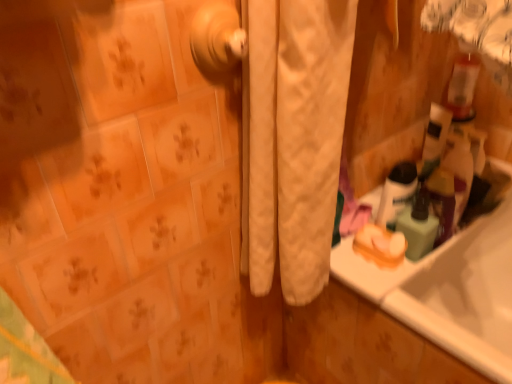
Question: Does white glossy mouthwash at upper right have a lesser height compared to white quilted curtain at center?

Choices:
 (A) yes
 (B) no

Answer: (A)

Question: Is white glossy mouthwash at upper right not within white quilted curtain at center?

Choices:
 (A) yes
 (B) no

Answer: (A)

Question: From a real-world perspective, is white glossy mouthwash at upper right beneath white quilted curtain at center?

Choices:
 (A) yes
 (B) no

Answer: (A)

Question: Can you confirm if white glossy mouthwash at upper right is bigger than white quilted curtain at center?

Choices:
 (A) no
 (B) yes

Answer: (A)

Question: Considering the relative positions of white glossy mouthwash at upper right and white quilted curtain at center in the image provided, is white glossy mouthwash at upper right to the right of white quilted curtain at center from the viewer's perspective?

Choices:
 (A) no
 (B) yes

Answer: (B)

Question: Is translucent plastic soap dispenser at right wider or thinner than white quilted curtain at center?

Choices:
 (A) thin
 (B) wide

Answer: (A)

Question: Considering the positions of translucent plastic soap dispenser at right and white quilted curtain at center in the image, is translucent plastic soap dispenser at right taller or shorter than white quilted curtain at center?

Choices:
 (A) tall
 (B) short

Answer: (B)

Question: Looking at the image, does translucent plastic soap dispenser at right seem bigger or smaller compared to white quilted curtain at center?

Choices:
 (A) small
 (B) big

Answer: (A)

Question: Is translucent plastic soap dispenser at right spatially inside white quilted curtain at center, or outside of it?

Choices:
 (A) inside
 (B) outside

Answer: (B)

Question: Is white quilted curtain at center bigger or smaller than white glossy mouthwash at upper right?

Choices:
 (A) small
 (B) big

Answer: (B)

Question: From the image's perspective, is white quilted curtain at center located above or below white glossy mouthwash at upper right?

Choices:
 (A) above
 (B) below

Answer: (A)

Question: In terms of height, does white quilted curtain at center look taller or shorter compared to white glossy mouthwash at upper right?

Choices:
 (A) short
 (B) tall

Answer: (B)

Question: Considering the relative positions of white quilted curtain at center and white glossy mouthwash at upper right in the image provided, is white quilted curtain at center to the left or to the right of white glossy mouthwash at upper right?

Choices:
 (A) left
 (B) right

Answer: (A)

Question: From a real-world perspective, is white quilted curtain at center above or below translucent plastic soap dispenser at right?

Choices:
 (A) below
 (B) above

Answer: (B)

Question: In terms of width, does white quilted curtain at center look wider or thinner when compared to translucent plastic soap dispenser at right?

Choices:
 (A) thin
 (B) wide

Answer: (B)